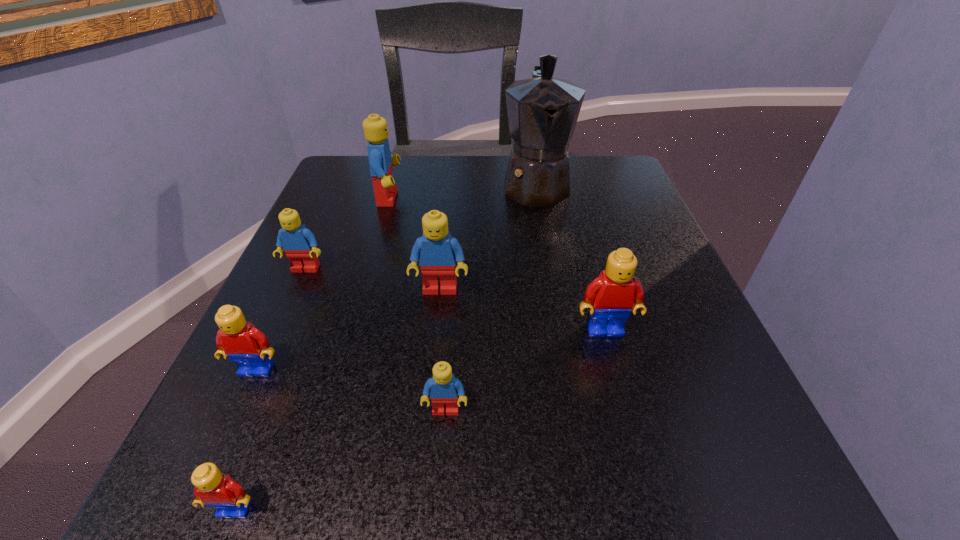
Locate an element on the screen. The width and height of the screenshot is (960, 540). coffeepot is located at coordinates (542, 111).

What are the coordinates of `the biggest blue Lego` in the screenshot? It's located at (375, 128).

In order to click on the tallest Lego in this screenshot , I will do `click(375, 128)`.

Find the location of a particular element. The image size is (960, 540). the third smallest blue Lego is located at coordinates (437, 252).

Find the location of a particular element. the third farthest Lego is located at coordinates (437, 252).

At what (x,y) coordinates should I click in order to perform the action: click on the rightmost Lego. Please return your answer as a coordinate pair (x, y). This screenshot has height=540, width=960. Looking at the image, I should click on tap(610, 297).

The image size is (960, 540). I want to click on the biggest yellow Lego, so click(610, 297).

Identify the location of the leftmost blue Lego. The image size is (960, 540). (299, 243).

I want to click on the third biggest blue Lego, so click(299, 243).

What are the coordinates of `the second farthest yellow Lego` in the screenshot? It's located at (247, 346).